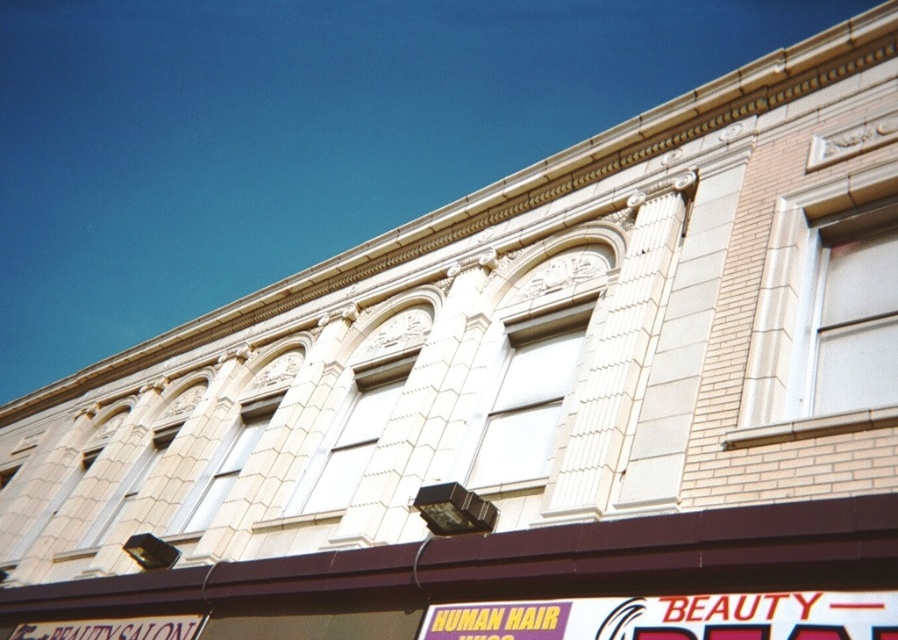
Question: Which point is closer to the camera?

Choices:
 (A) brown matte awning at center
 (B) yellow matte sign at lower center

Answer: (B)

Question: Which of the following is the closest to the observer?

Choices:
 (A) (492, 616)
 (B) (163, 589)

Answer: (A)

Question: Is brown matte awning at center to the left of yellow matte sign at lower center from the viewer's perspective?

Choices:
 (A) no
 (B) yes

Answer: (B)

Question: Observing the image, what is the correct spatial positioning of brown matte awning at center in reference to yellow matte sign at lower center?

Choices:
 (A) above
 (B) below

Answer: (B)

Question: Does brown matte awning at center come in front of yellow matte sign at lower center?

Choices:
 (A) no
 (B) yes

Answer: (A)